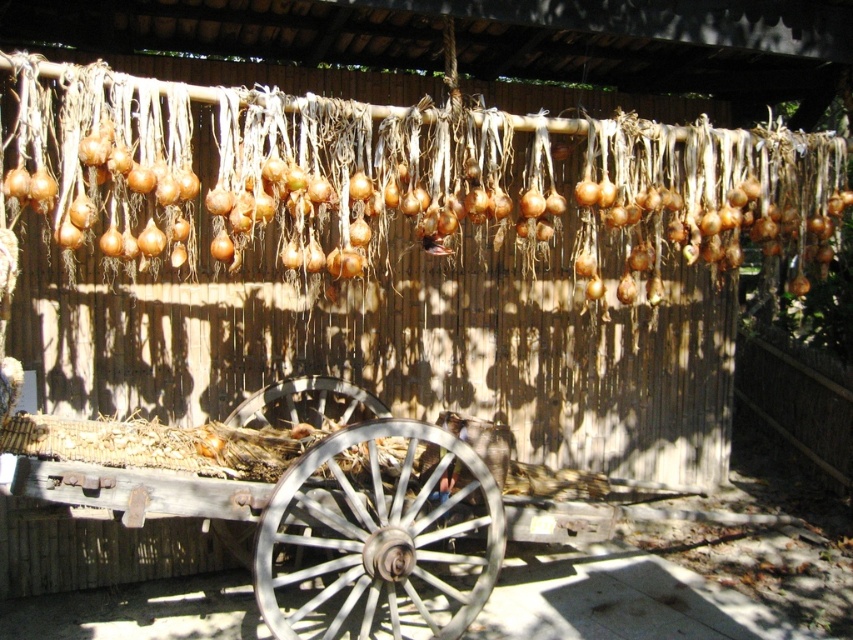
Question: Among these objects, which one is farthest from the camera?

Choices:
 (A) wooden wagon wheel at center
 (B) silver metallic wagon wheel at center

Answer: (A)

Question: Is silver metallic wagon wheel at center positioned before wooden wagon wheel at center?

Choices:
 (A) no
 (B) yes

Answer: (B)

Question: Can you confirm if silver metallic wagon wheel at center is bigger than wooden wagon wheel at center?

Choices:
 (A) yes
 (B) no

Answer: (A)

Question: Does silver metallic wagon wheel at center have a lesser width compared to wooden wagon wheel at center?

Choices:
 (A) yes
 (B) no

Answer: (B)

Question: Which of the following is the farthest from the observer?

Choices:
 (A) silver metallic wagon wheel at center
 (B) wooden wagon wheel at center

Answer: (B)